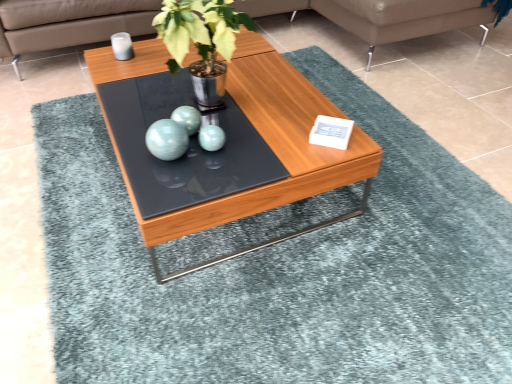
The width and height of the screenshot is (512, 384). Find the location of `vacant area that lies in front of teal glossy sphere at center`. vacant area that lies in front of teal glossy sphere at center is located at coordinates (167, 186).